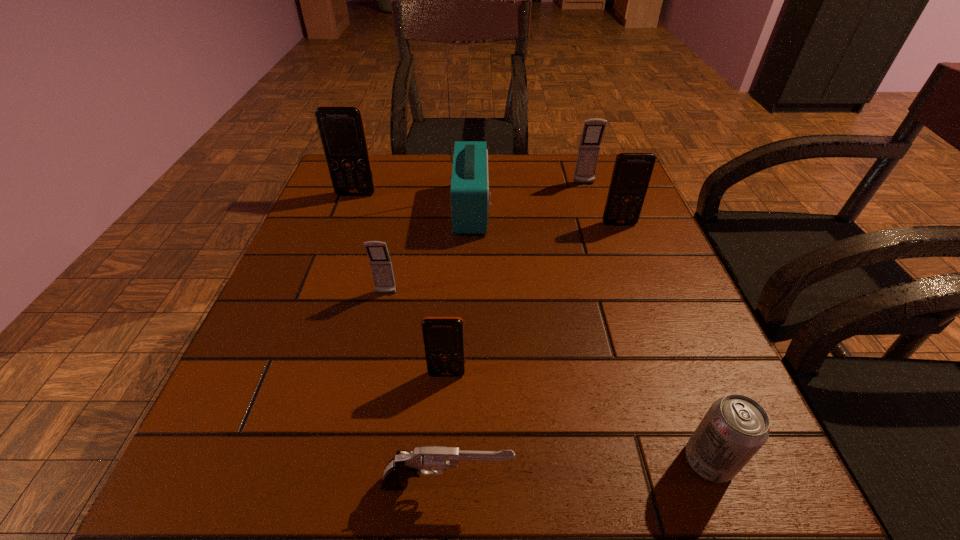
The image size is (960, 540). What are the coordinates of `vacant position in the image that satisfies the following two spatial constraints: 1. on the screen of the leftmost object; 2. on the right side of the gray soda can` in the screenshot? It's located at click(255, 461).